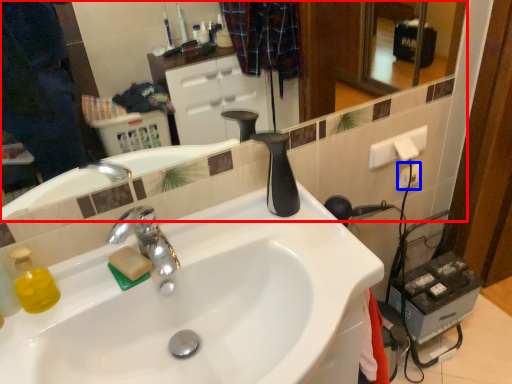
Question: Which object appears closest to the camera in this image, mirror (highlighted by a red box) or electric outlet (highlighted by a blue box)?

Choices:
 (A) mirror
 (B) electric outlet

Answer: (A)